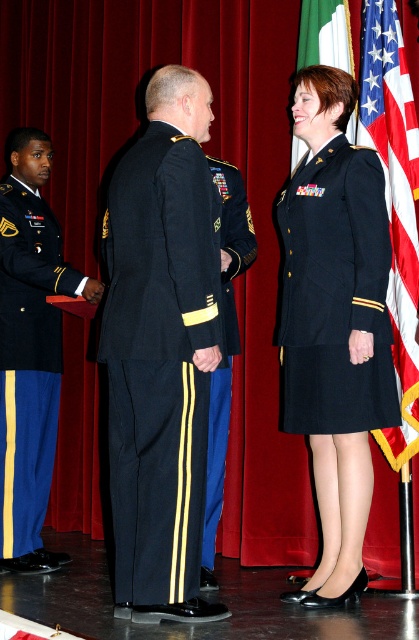
Consider the image. Is blue wool uniform at left bigger than american flag at right?

Correct, blue wool uniform at left is larger in size than american flag at right.

The width and height of the screenshot is (419, 640). Identify the location of blue wool uniform at left. (28, 362).

Image resolution: width=419 pixels, height=640 pixels. Describe the element at coordinates (28, 362) in the screenshot. I see `blue wool uniform at left` at that location.

The width and height of the screenshot is (419, 640). Find the location of `blue wool uniform at left`. blue wool uniform at left is located at coordinates (28, 362).

What are the coordinates of `navy blue fabric uniform at center` in the screenshot? It's located at (x=158, y=358).

At what (x,y) coordinates should I click in order to perform the action: click on navy blue fabric uniform at center. Please return your answer as a coordinate pair (x, y). Image resolution: width=419 pixels, height=640 pixels. Looking at the image, I should click on (158, 358).

Is american flag at right wider than shiny black jacket at center?

Yes.

Is american flag at right closer to the viewer compared to shiny black jacket at center?

No, american flag at right is behind shiny black jacket at center.

Between point (410, 268) and point (216, 438), which one is positioned in front?

Point (410, 268)

Identify the location of american flag at right. (395, 202).